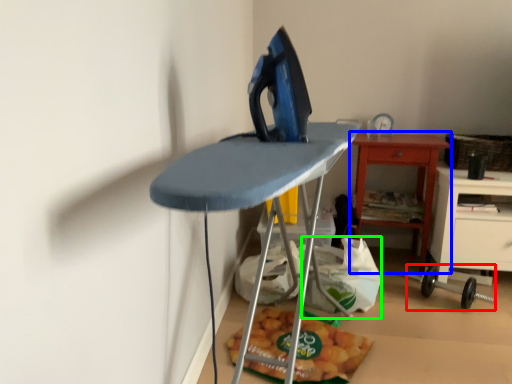
Question: Which is farther away from equipment (highlighted by a red box)? table (highlighted by a blue box) or grocery bag (highlighted by a green box)?

Choices:
 (A) table
 (B) grocery bag

Answer: (B)